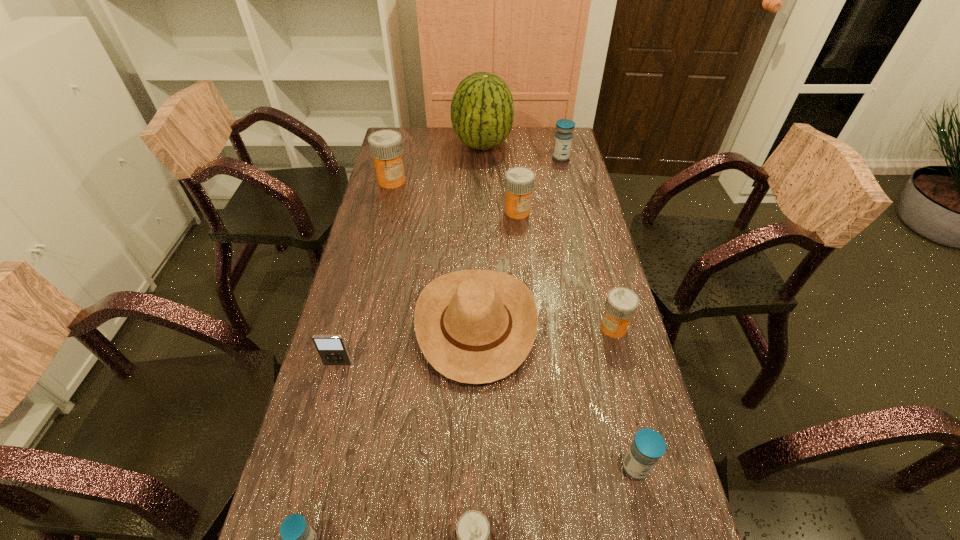
Where is `blank space at the left edge of the desktop`? Image resolution: width=960 pixels, height=540 pixels. blank space at the left edge of the desktop is located at coordinates tap(411, 199).

Find the location of a particular element. blank space at the right edge of the desktop is located at coordinates (564, 166).

Locate an element on the screen. vacant space that's between the second orange medicine from right to left and the cowboy hat is located at coordinates (497, 268).

The image size is (960, 540). Find the location of `vacant space that is in between the fourth farthest object and the rightmost orange medicine`. vacant space that is in between the fourth farthest object and the rightmost orange medicine is located at coordinates (565, 269).

You are a GUI agent. You are given a task and a screenshot of the screen. Output one action in this format:
    pyautogui.click(x=<x>, y=<y>)
    Task: Click on the free space between the brown cowboy hat and the third farthest object
    The height and width of the screenshot is (540, 960).
    Given the screenshot: What is the action you would take?
    pyautogui.click(x=434, y=253)

The width and height of the screenshot is (960, 540). I want to click on vacant space that's between the third farthest orange medicine and the cowboy hat, so click(545, 326).

Find the location of a particular element. Image resolution: width=960 pixels, height=540 pixels. free area in between the cowboy hat and the farthest medicine is located at coordinates (518, 241).

The width and height of the screenshot is (960, 540). Find the location of `free space between the brown cowboy hat and the iPod`. free space between the brown cowboy hat and the iPod is located at coordinates (407, 344).

Where is `object that stands as the second closest to the fifth nearest medicine`? This screenshot has width=960, height=540. object that stands as the second closest to the fifth nearest medicine is located at coordinates (482, 110).

Select which object is the fifth closest to the second smallest blue medicine. Please provide its 2D coordinates. Your answer should be formatted as a tuple, i.e. [(x, y)], where the tuple contains the x and y coordinates of a point satisfying the conditions above.

[(332, 350)]